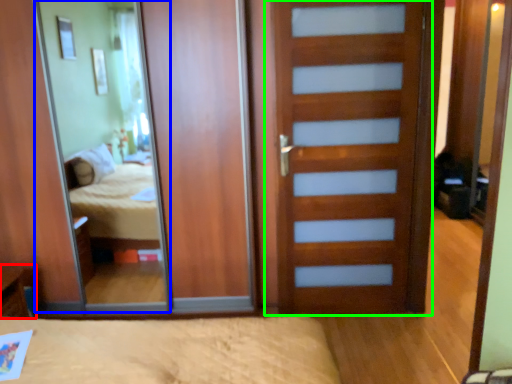
Question: Considering the real-world distances, which object is closest to table (highlighted by a red box)? mirror (highlighted by a blue box) or door (highlighted by a green box).

Choices:
 (A) mirror
 (B) door

Answer: (A)